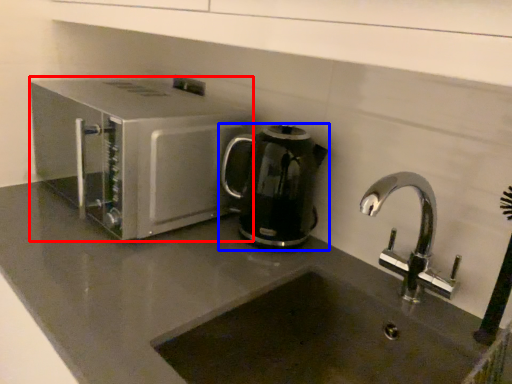
Question: Among these objects, which one is farthest to the camera, home appliance (highlighted by a red box) or kitchen appliance (highlighted by a blue box)?

Choices:
 (A) home appliance
 (B) kitchen appliance

Answer: (B)